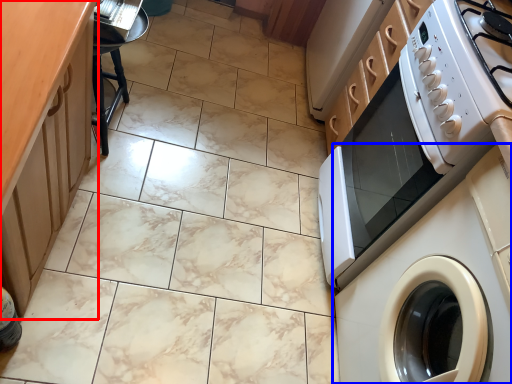
Question: Which object is further to the camera taking this photo, counter top (highlighted by a red box) or washing machine (highlighted by a blue box)?

Choices:
 (A) counter top
 (B) washing machine

Answer: (B)